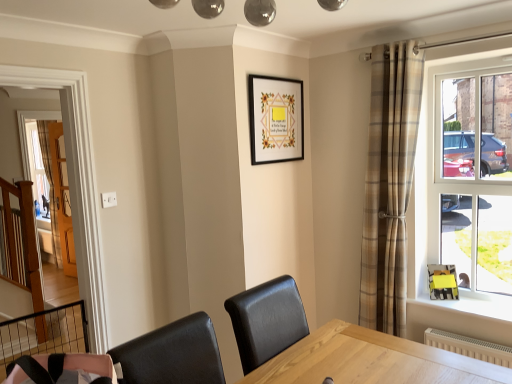
The height and width of the screenshot is (384, 512). Describe the element at coordinates (389, 184) in the screenshot. I see `plaid fabric curtain at right` at that location.

The image size is (512, 384). Identify the location of clear glass window at right. (462, 184).

What is the approximate width of white textured radiator at lower right?

It is 4.28 inches.

Where is `black matte picture frame at upper center`? black matte picture frame at upper center is located at coordinates (275, 119).

Is point (61, 328) farther from camera compared to point (397, 204)?

Yes, it is behind point (397, 204).

Would you say black metal balustrade at lower left is inside or outside plaid fabric curtain at right?

black metal balustrade at lower left lies outside plaid fabric curtain at right.

Measure the distance between black metal balustrade at lower left and plaid fabric curtain at right.

black metal balustrade at lower left and plaid fabric curtain at right are 2.70 meters apart.

Locate an element on the screen. Image resolution: width=512 pixels, height=384 pixels. picture frame to the left of clear glass window at right is located at coordinates [275, 119].

Is clear glass window at right taller than black matte picture frame at upper center?

Yes, clear glass window at right is taller than black matte picture frame at upper center.

Can you confirm if clear glass window at right is smaller than black matte picture frame at upper center?

No.

Do you think clear glass window at right is within black matte picture frame at upper center, or outside of it?

The correct answer is: outside.

Is point (397, 62) farther from viewer compared to point (429, 143)?

No, (397, 62) is closer to viewer.

Does plaid fabric curtain at right have a lesser height compared to clear glass window at right?

No.

Is plaid fabric curtain at right not near clear glass window at right?

They are positioned close to each other.

Is plaid fabric curtain at right facing away from clear glass window at right?

No, plaid fabric curtain at right's orientation is not away from clear glass window at right.

From the image's perspective, which is above, white textured radiator at lower right or clear glass window at right?

clear glass window at right.

Is white textured radiator at lower right in front of or behind clear glass window at right in the image?

In the image, white textured radiator at lower right appears in front of clear glass window at right.

Identify the location of window that appears behind the white textured radiator at lower right. (462, 184).

Is white textured radiator at lower right touching clear glass window at right?

No, white textured radiator at lower right is not making contact with clear glass window at right.

Where is `curtain located above the white textured radiator at lower right (from a real-world perspective)`? curtain located above the white textured radiator at lower right (from a real-world perspective) is located at coordinates (389, 184).

Considering the sizes of objects plaid fabric curtain at right and white textured radiator at lower right in the image provided, who is smaller, plaid fabric curtain at right or white textured radiator at lower right?

white textured radiator at lower right is smaller.

In the scene shown: Would you say plaid fabric curtain at right is to the left or to the right of white textured radiator at lower right in the picture?

plaid fabric curtain at right is positioned on white textured radiator at lower right's left side.

Is plaid fabric curtain at right not inside white textured radiator at lower right?

Indeed, plaid fabric curtain at right is completely outside white textured radiator at lower right.

Which is less distant, (285,121) or (418,54)?

The point (418,54) is more forward.

Is black matte picture frame at upper center looking in the opposite direction of plaid fabric curtain at right?

No.

From a real-world perspective, relative to plaid fabric curtain at right, is black matte picture frame at upper center vertically above or below?

Clearly, from a real-world perspective, black matte picture frame at upper center is above plaid fabric curtain at right.

Which of these two, black matte picture frame at upper center or plaid fabric curtain at right, is wider?

With larger width is plaid fabric curtain at right.

Can you confirm if white textured radiator at lower right is taller than black metal balustrade at lower left?

Incorrect, the height of white textured radiator at lower right is not larger of that of black metal balustrade at lower left.

In the scene shown: Is white textured radiator at lower right in contact with black metal balustrade at lower left?

No, white textured radiator at lower right is not beside black metal balustrade at lower left.

Is white textured radiator at lower right oriented away from black metal balustrade at lower left?

No, white textured radiator at lower right's orientation is not away from black metal balustrade at lower left.

Is white textured radiator at lower right bigger or smaller than black metal balustrade at lower left?

Considering their sizes, white textured radiator at lower right takes up less space than black metal balustrade at lower left.

Where is `balustrade that is on the left side of plaid fabric curtain at right`? The image size is (512, 384). balustrade that is on the left side of plaid fabric curtain at right is located at coordinates (44, 334).

Locate an element on the screen. The width and height of the screenshot is (512, 384). window directly beneath the black matte picture frame at upper center (from a real-world perspective) is located at coordinates (462, 184).

Looking at this image, which object lies nearer to the anchor point black metal balustrade at lower left, black matte picture frame at upper center or clear glass window at right?

The object closer to black metal balustrade at lower left is black matte picture frame at upper center.

From the image, which object appears to be farther from black metal balustrade at lower left, black matte picture frame at upper center or plaid fabric curtain at right?

The object further to black metal balustrade at lower left is plaid fabric curtain at right.

Which object lies nearer to the anchor point clear glass window at right, black metal balustrade at lower left or black matte picture frame at upper center?

Based on the image, black matte picture frame at upper center appears to be nearer to clear glass window at right.

Estimate the real-world distances between objects in this image. Which object is further from white textured radiator at lower right, clear glass window at right or black metal balustrade at lower left?

black metal balustrade at lower left lies further to white textured radiator at lower right than the other object.

From the image, which object appears to be nearer to plaid fabric curtain at right, clear glass window at right or black metal balustrade at lower left?

Among the two, clear glass window at right is located nearer to plaid fabric curtain at right.

Considering their positions, is white textured radiator at lower right positioned closer to plaid fabric curtain at right than clear glass window at right?

clear glass window at right.

From the image, which object appears to be nearer to plaid fabric curtain at right, black matte picture frame at upper center or white textured radiator at lower right?

black matte picture frame at upper center is closer to plaid fabric curtain at right.

Looking at the image, which one is located closer to black matte picture frame at upper center, clear glass window at right or black metal balustrade at lower left?

Among the two, clear glass window at right is located nearer to black matte picture frame at upper center.

The width and height of the screenshot is (512, 384). Identify the location of window between black matte picture frame at upper center and white textured radiator at lower right in the up-down direction. (462, 184).

The height and width of the screenshot is (384, 512). Identify the location of curtain situated between black matte picture frame at upper center and clear glass window at right from left to right. (389, 184).

Find the location of a particular element. The image size is (512, 384). curtain between black metal balustrade at lower left and clear glass window at right is located at coordinates (389, 184).

Find the location of a particular element. The image size is (512, 384). picture frame located between black metal balustrade at lower left and white textured radiator at lower right in the left-right direction is located at coordinates (275, 119).